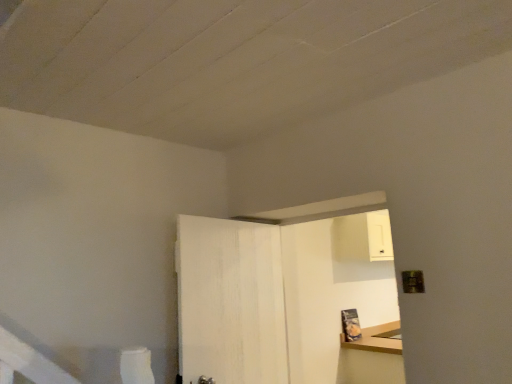
Question: Does point (193, 286) appear closer or farther from the camera than point (312, 236)?

Choices:
 (A) closer
 (B) farther

Answer: (A)

Question: Is white wood door at center inside or outside of white wood dresser at upper right?

Choices:
 (A) inside
 (B) outside

Answer: (B)

Question: From a real-world perspective, relative to white wood dresser at upper right, is white wood door at center vertically above or below?

Choices:
 (A) above
 (B) below

Answer: (A)

Question: Is point (180, 225) closer or farther from the camera than point (238, 253)?

Choices:
 (A) closer
 (B) farther

Answer: (A)

Question: From a real-world perspective, is white wood dresser at upper right physically located above or below white wood door at center?

Choices:
 (A) below
 (B) above

Answer: (A)

Question: From the image's perspective, is white wood dresser at upper right above or below white wood door at center?

Choices:
 (A) above
 (B) below

Answer: (B)

Question: Looking at their shapes, would you say white wood dresser at upper right is wider or thinner than white wood door at center?

Choices:
 (A) wide
 (B) thin

Answer: (A)